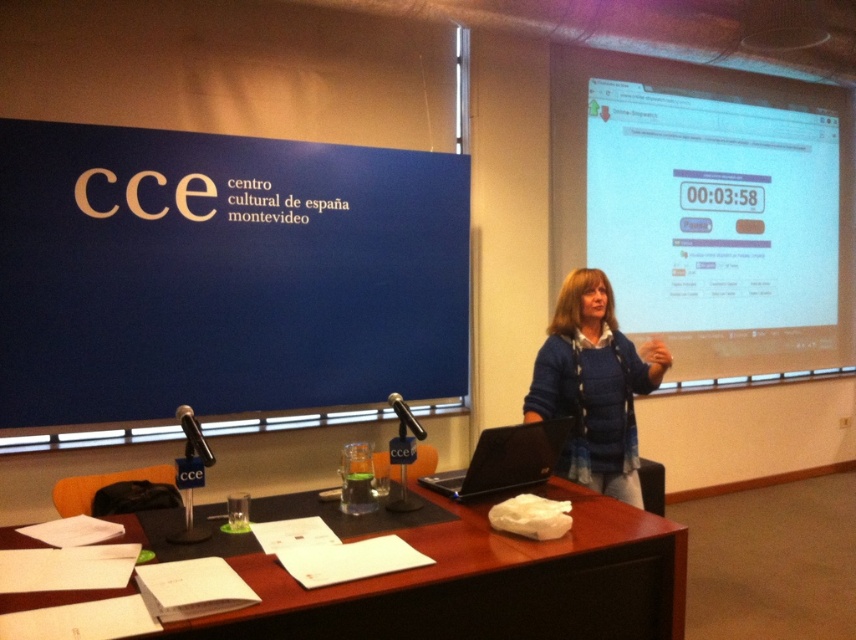
You are attending a presentation at the CCE and notice two points marked on the floor. The first point is at coordinate point [625,381] and the second is at point [526,480]. If you are standing at the first point, which direction should you move to reach the second point?

To move from point [625,381] to point [526,480], you should move towards the northeast direction since the second point has a higher x and lower y coordinate compared to the first point.

In the scene shown: You are an attendee at the presentation. The presenter is wearing a blue knitted sweater at center. If you want to estimate where the presenter is standing relative to the stage, what coordinates would you use?

The presenter is wearing the blue knitted sweater at center, which is located at coordinates point [593,387]. This indicates the presenter is positioned slightly to the right and upper part of the stage.

You are an attendee at the presentation. You need to place a name tag on the brown wooden table at center without blocking the blue knitted sweater at center. Is the table large enough to accommodate the name tag?

The brown wooden table at center is positioned under blue knitted sweater at center, which means the sweater is covering part of the table. Therefore, there might not be enough space to place the name tag without overlapping the sweater.